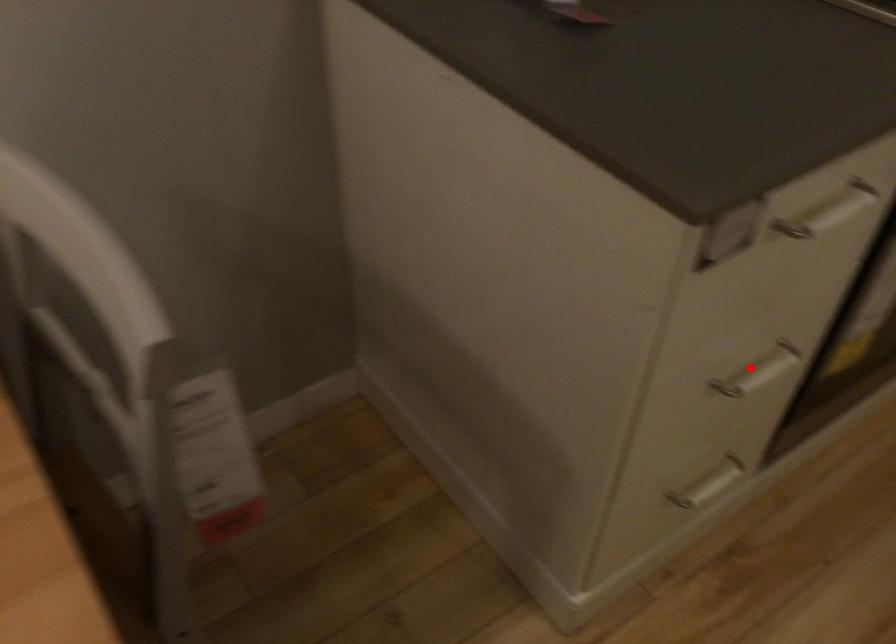
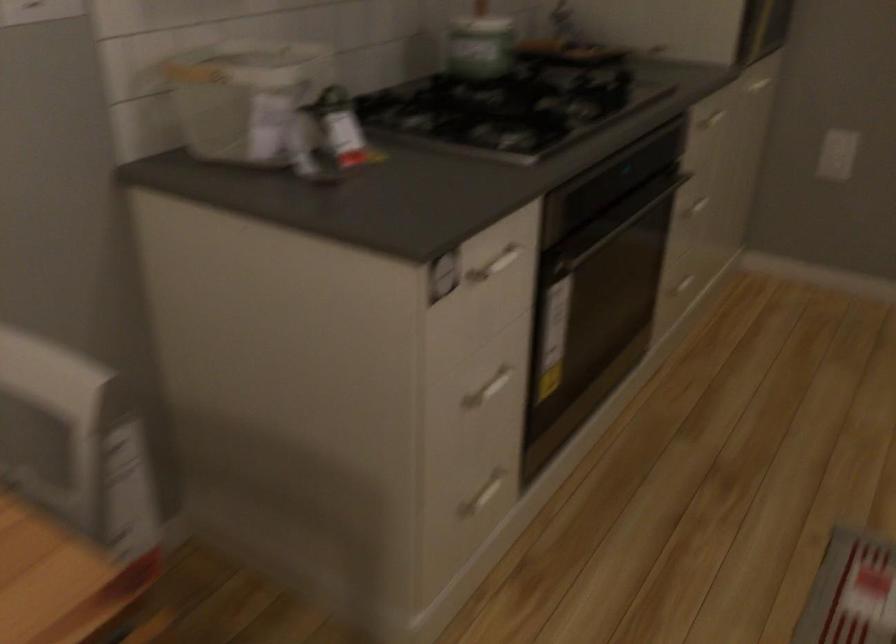
Locate, in the second image, the point that corresponds to the highlighted location in the first image.

(487, 389)